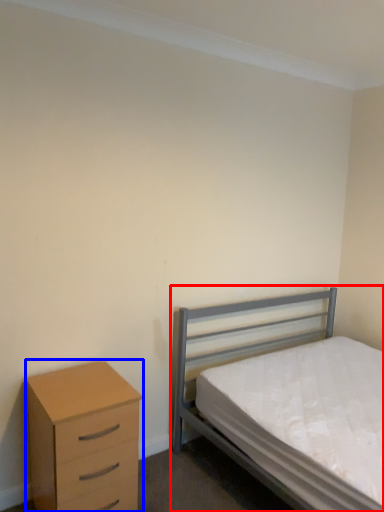
Question: Among these objects, which one is nearest to the camera, bed (highlighted by a red box) or chest of drawers (highlighted by a blue box)?

Choices:
 (A) bed
 (B) chest of drawers

Answer: (A)